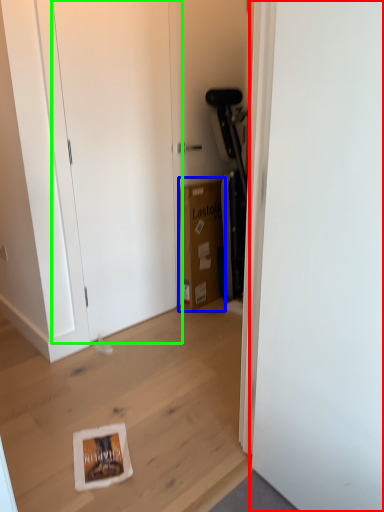
Question: Which object is positioned farthest from door (highlighted by a red box)? Select from cardboard box (highlighted by a blue box) and door (highlighted by a green box).

Choices:
 (A) cardboard box
 (B) door

Answer: (A)